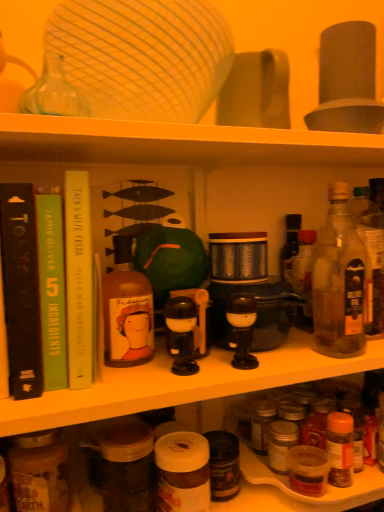
Question: Considering the relative sizes of clear glass bottle at right, marked as the second bottle in a right-to-left arrangement, and matte glass bottle at center-left, which is the third bottle in right-to-left order, in the image provided, is clear glass bottle at right, marked as the second bottle in a right-to-left arrangement, bigger than matte glass bottle at center-left, which is the third bottle in right-to-left order,?

Choices:
 (A) yes
 (B) no

Answer: (A)

Question: Does clear glass bottle at right, marked as the second bottle in a right-to-left arrangement, appear on the right side of matte glass bottle at center-left, which is the third bottle in right-to-left order?

Choices:
 (A) no
 (B) yes

Answer: (B)

Question: Is clear glass bottle at right, marked as the second bottle in a right-to-left arrangement, smaller than matte glass bottle at center-left, which is the 2th bottle from left to right?

Choices:
 (A) yes
 (B) no

Answer: (B)

Question: Is clear glass bottle at right, marked as the second bottle in a right-to-left arrangement, positioned far away from matte glass bottle at center-left, which is the third bottle in right-to-left order?

Choices:
 (A) no
 (B) yes

Answer: (A)

Question: Could you tell me if clear glass bottle at right, which appears as the third bottle when viewed from the left, is turned towards matte glass bottle at center-left, which is the 2th bottle from left to right?

Choices:
 (A) no
 (B) yes

Answer: (A)

Question: Is clear glass bottle at right, which appears as the third bottle when viewed from the left, behind matte glass bottle at center-left, which is the third bottle in right-to-left order?

Choices:
 (A) no
 (B) yes

Answer: (B)

Question: Is green paperback book at left, positioned as the 2th book in right-to-left order, to the left of matte black coffee machine at center from the viewer's perspective?

Choices:
 (A) no
 (B) yes

Answer: (B)

Question: Is green paperback book at left, positioned as the 2th book in right-to-left order, positioned before matte black coffee machine at center?

Choices:
 (A) no
 (B) yes

Answer: (B)

Question: Can you confirm if green paperback book at left, the second book viewed from the left, is bigger than matte black coffee machine at center?

Choices:
 (A) no
 (B) yes

Answer: (A)

Question: From the image's perspective, is green paperback book at left, the second book viewed from the left, beneath matte black coffee machine at center?

Choices:
 (A) yes
 (B) no

Answer: (B)

Question: Is green paperback book at left, positioned as the 2th book in right-to-left order, located outside matte black coffee machine at center?

Choices:
 (A) yes
 (B) no

Answer: (A)

Question: From a real-world perspective, is green paperback book at left, positioned as the 2th book in right-to-left order, below matte black coffee machine at center?

Choices:
 (A) yes
 (B) no

Answer: (B)

Question: Can you confirm if green paperback book at left, positioned as the 2th book in right-to-left order, is thinner than translucent glass bottle at right, the first bottle viewed from the right?

Choices:
 (A) no
 (B) yes

Answer: (A)